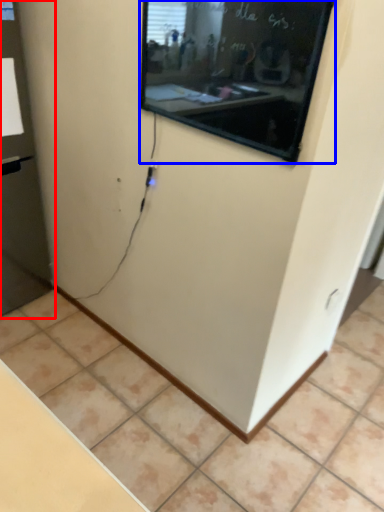
Question: Which of the following is the farthest to the observer, glass door (highlighted by a red box) or projection screen (highlighted by a blue box)?

Choices:
 (A) glass door
 (B) projection screen

Answer: (A)